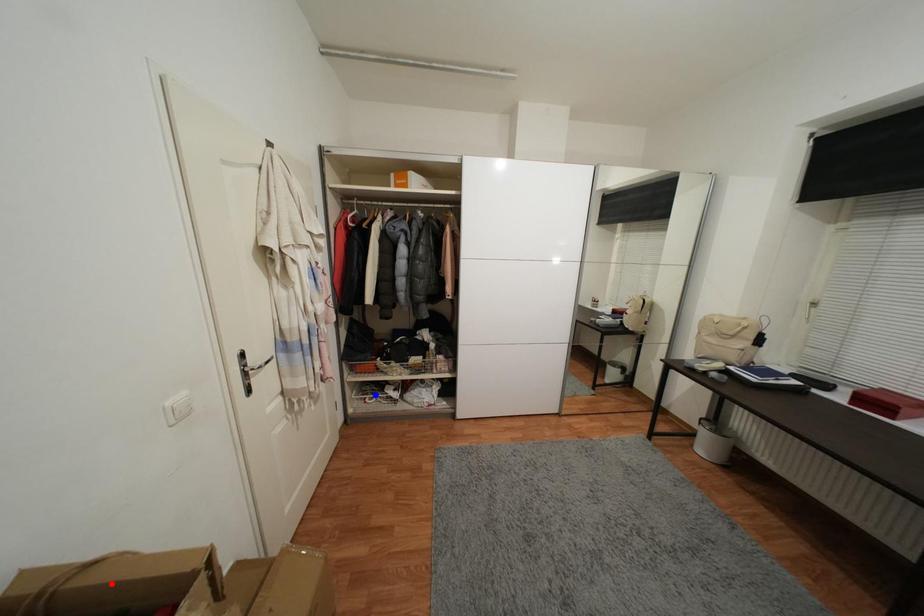
Question: In the image, two points are highlighted. Which point is nearer to the camera? Reply with the corresponding letter.

Choices:
 (A) blue point
 (B) red point

Answer: (B)